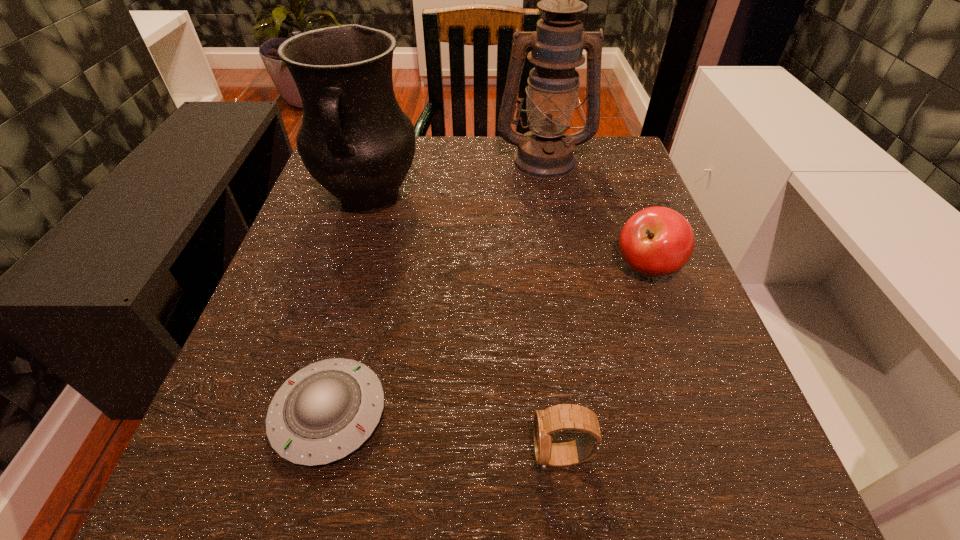
Locate an element on the screen. The image size is (960, 540). blank area in the image that satisfies the following two spatial constraints: 1. on the handle side of the apple; 2. on the left side of the pitcher is located at coordinates (348, 268).

You are a GUI agent. You are given a task and a screenshot of the screen. Output one action in this format:
    pyautogui.click(x=<x>, y=<y>)
    Task: Click on the free space that satisfies the following two spatial constraints: 1. on the handle side of the shortest object; 2. on the left side of the pitcher
    Image resolution: width=960 pixels, height=540 pixels.
    Given the screenshot: What is the action you would take?
    pyautogui.click(x=306, y=414)

Identify the location of vacant space that satisfies the following two spatial constraints: 1. on the handle side of the pitcher; 2. on the right side of the third farthest object. (348, 268).

Locate an element on the screen. The image size is (960, 540). vacant space that satisfies the following two spatial constraints: 1. on the back side of the shortest object; 2. on the right side of the oil lamp is located at coordinates (394, 160).

Locate an element on the screen. The image size is (960, 540). free space in the image that satisfies the following two spatial constraints: 1. on the front side of the oil lamp; 2. on the face of the watch is located at coordinates (599, 456).